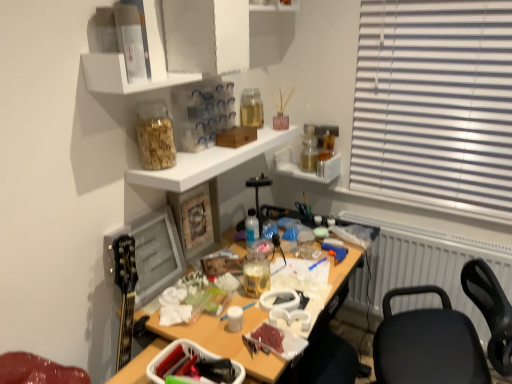
Where is `empty space that is ontop of white plastic radiator at right (from a real-world perspective)`? Image resolution: width=512 pixels, height=384 pixels. empty space that is ontop of white plastic radiator at right (from a real-world perspective) is located at coordinates point(455,231).